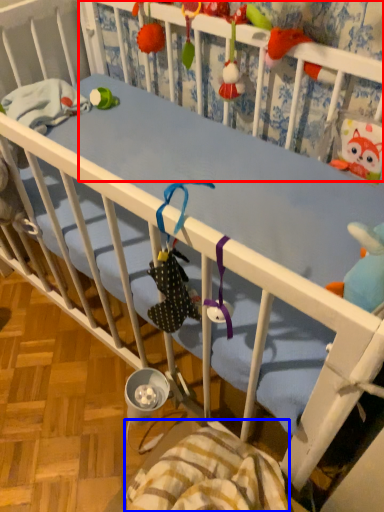
Question: Which object appears closest to the camera in this image, infant bed (highlighted by a red box) or blanket (highlighted by a blue box)?

Choices:
 (A) infant bed
 (B) blanket

Answer: (B)